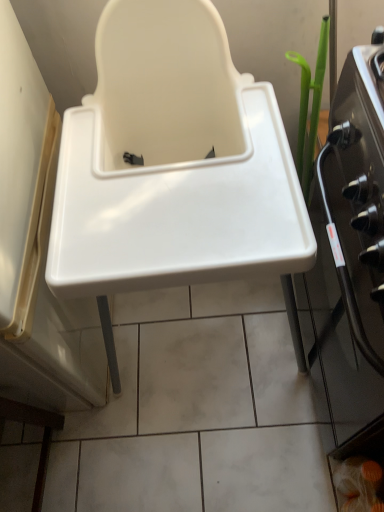
Question: Is black glass oven at right taller or shorter than white plastic sink at center?

Choices:
 (A) tall
 (B) short

Answer: (B)

Question: From the image's perspective, is black glass oven at right positioned above or below white plastic sink at center?

Choices:
 (A) below
 (B) above

Answer: (A)

Question: Is point (332, 236) positioned closer to the camera than point (117, 252)?

Choices:
 (A) farther
 (B) closer

Answer: (A)

Question: Which is correct: white plastic sink at center is inside black glass oven at right, or outside of it?

Choices:
 (A) outside
 (B) inside

Answer: (A)

Question: Based on their sizes in the image, would you say white plastic sink at center is bigger or smaller than black glass oven at right?

Choices:
 (A) small
 (B) big

Answer: (B)

Question: In the image, is white plastic sink at center positioned in front of or behind black glass oven at right?

Choices:
 (A) front
 (B) behind

Answer: (A)

Question: In the image, is white plastic sink at center on the left side or the right side of black glass oven at right?

Choices:
 (A) left
 (B) right

Answer: (A)